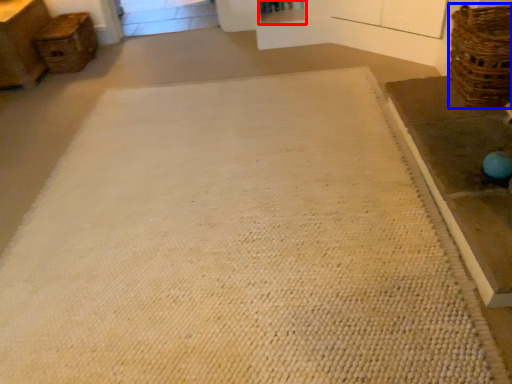
Question: Which of the following is the farthest to the observer, shelf (highlighted by a red box) or basket (highlighted by a blue box)?

Choices:
 (A) shelf
 (B) basket

Answer: (A)